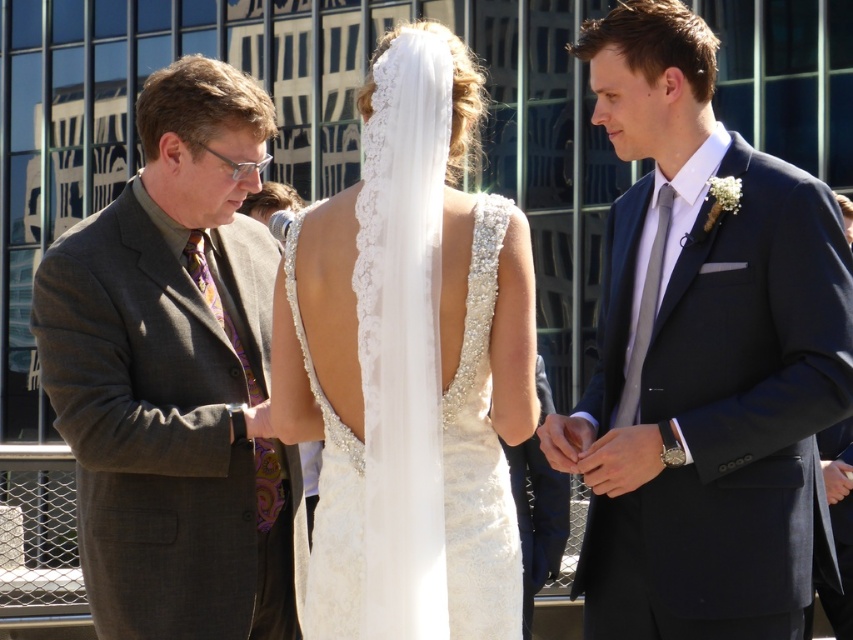
You are a photographer at the wedding. You need to capture a closeup shot of the gray textured suit at left and the white lace veil at center. Which object will require a wider angle to capture fully in the frame?

The white lace veil at center requires a wider angle because its width is greater than the gray textured suit at left.

You are a photographer at the wedding. You want to capture a shot of the bride from behind, ensuring both the ivory lace dress at center and the white lace veil at center are visible. Based on their positions, will the veil cover the dress in the photo?

The ivory lace dress at center is located below the white lace veil at center, so the veil may partially cover the dress in the photo depending on their positioning.

You are a photographer at the wedding and want to capture the bride from the front. The ivory lace dress at center and white lace veil at center are in your view. Which one is closer to you?

The ivory lace dress at center is closer to you because the white lace veil at center is behind it.